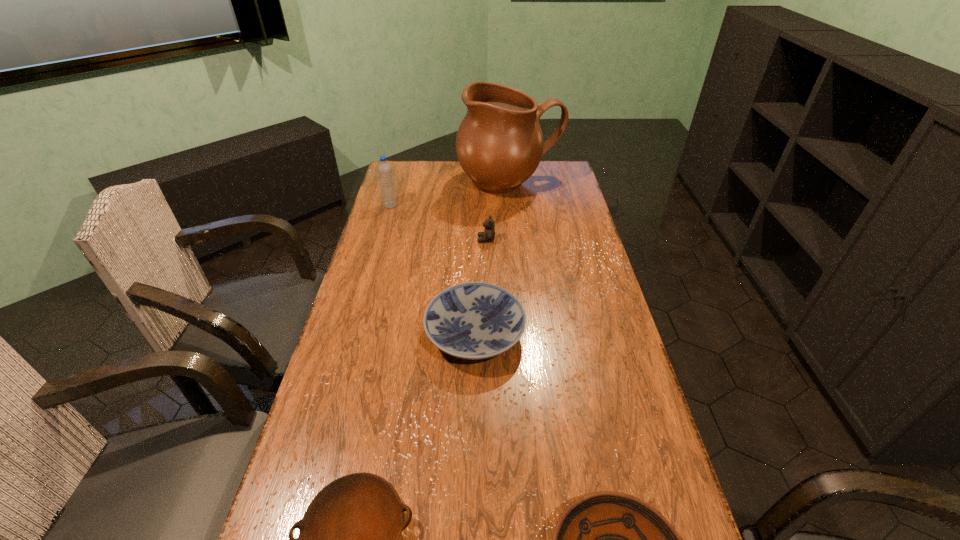
Locate an element on the screen. The width and height of the screenshot is (960, 540). cream pitcher is located at coordinates (499, 144).

You are a GUI agent. You are given a task and a screenshot of the screen. Output one action in this format:
    pyautogui.click(x=<x>, y=<y>)
    Task: Click on the water bottle
    The image size is (960, 540).
    Given the screenshot: What is the action you would take?
    pyautogui.click(x=384, y=169)

The height and width of the screenshot is (540, 960). Find the location of `teddy bear`. teddy bear is located at coordinates (488, 235).

Locate an element on the screen. the fourth shortest object is located at coordinates (488, 235).

Identify the location of the tallest plate. tap(475, 320).

The width and height of the screenshot is (960, 540). Identify the location of the farthest plate. (475, 320).

At what (x,y) coordinates should I click in order to perform the action: click on vacant space located at the spout of the cream pitcher. Please return your answer as a coordinate pair (x, y). This screenshot has height=540, width=960. Looking at the image, I should click on coord(516,242).

I want to click on free region located on the front of the fifth shortest object, so click(381, 235).

Where is `free spot located 0.370m on the face of the third tallest object`? This screenshot has height=540, width=960. free spot located 0.370m on the face of the third tallest object is located at coordinates (375, 240).

The image size is (960, 540). Find the location of `vacant space situated on the face of the third tallest object`. vacant space situated on the face of the third tallest object is located at coordinates (375, 240).